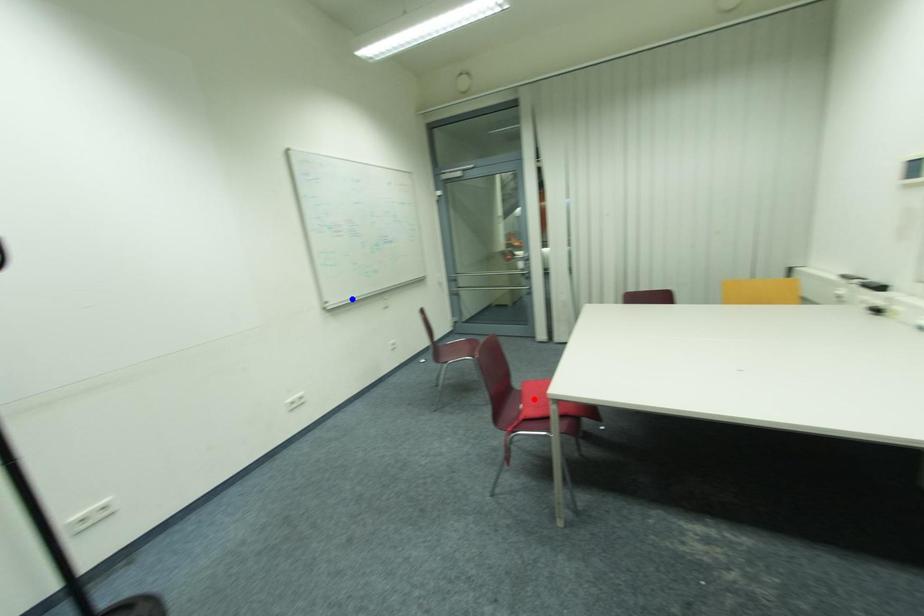
Question: In the image, two points are highlighted. Which point is nearer to the camera? Reply with the corresponding letter.

Choices:
 (A) blue point
 (B) red point

Answer: (B)